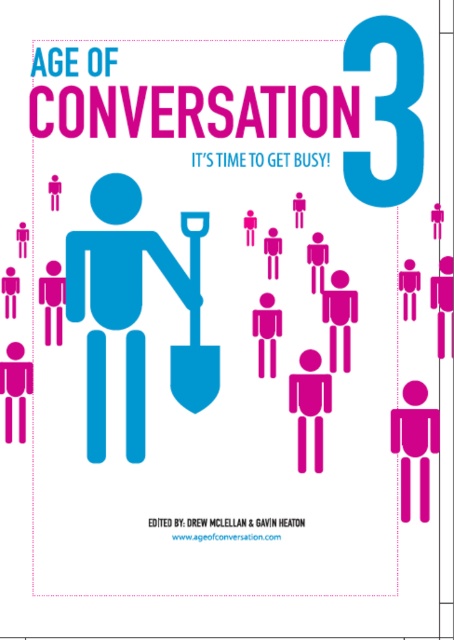
Looking at the cover design for the publication, where is the matte blue figure at center in relation to the blue matte shovel at center?

The matte blue figure at center is to the left of the blue matte shovel at center.

Looking at the cover design for the publication, you notice the matte blue figure at center and the blue matte shovel at center. Which object takes up more space in the image?

The matte blue figure at center has a larger size compared to the blue matte shovel at center, so it takes up more space in the image.